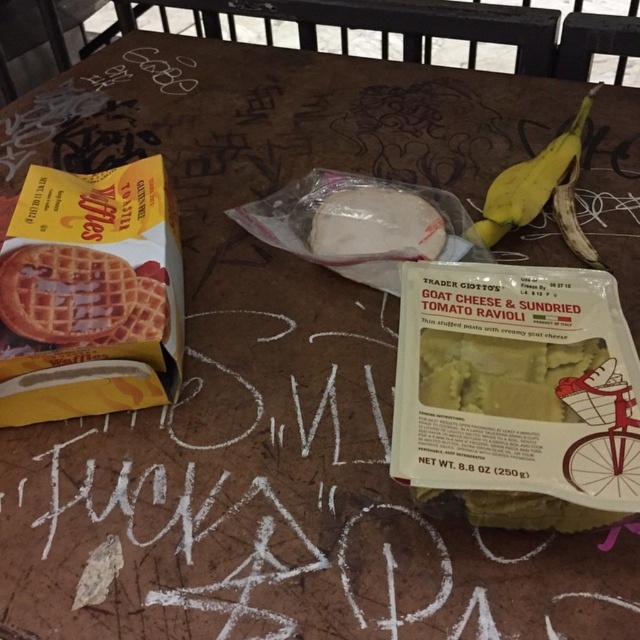
How far apart are white matte ravioli at center and yellow matte banana at upper right?

white matte ravioli at center is 14.29 centimeters from yellow matte banana at upper right.

Between point (326, 225) and point (568, 168), which one is positioned in front?

Positioned in front is point (326, 225).

The height and width of the screenshot is (640, 640). What do you see at coordinates (376, 225) in the screenshot? I see `white matte ravioli at center` at bounding box center [376, 225].

The height and width of the screenshot is (640, 640). Find the location of `white matte ravioli at center`. white matte ravioli at center is located at coordinates (376, 225).

Which is behind, point (116, 316) or point (374, 253)?

Positioned behind is point (374, 253).

Measure the distance between point (x=140, y=332) and camera.

Point (x=140, y=332) is 21.09 inches away from camera.

Is point (92, 330) closer to camera compared to point (413, 243)?

That is True.

Identify the location of golden brown waffle at left. This screenshot has width=640, height=640. (80, 296).

Which of these two, yellow matte waffles at upper left or golden brown waffle at left, stands shorter?

golden brown waffle at left is shorter.

Does point (132, 339) come closer to viewer compared to point (38, 248)?

Yes, point (132, 339) is in front of point (38, 248).

The height and width of the screenshot is (640, 640). I want to click on yellow matte waffles at upper left, so click(x=90, y=294).